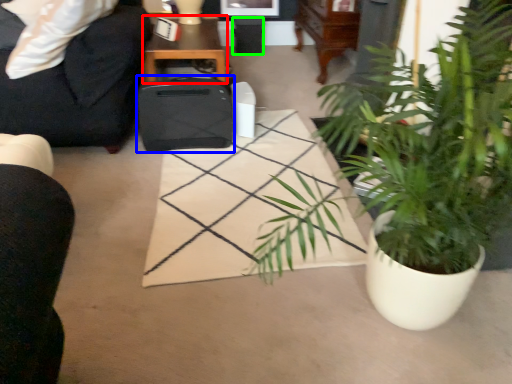
Question: Estimate the real-world distances between objects in this image. Which object is closer to table (highlighted by a red box), luggage (highlighted by a blue box) or trash bin/can (highlighted by a green box)?

Choices:
 (A) luggage
 (B) trash bin/can

Answer: (A)